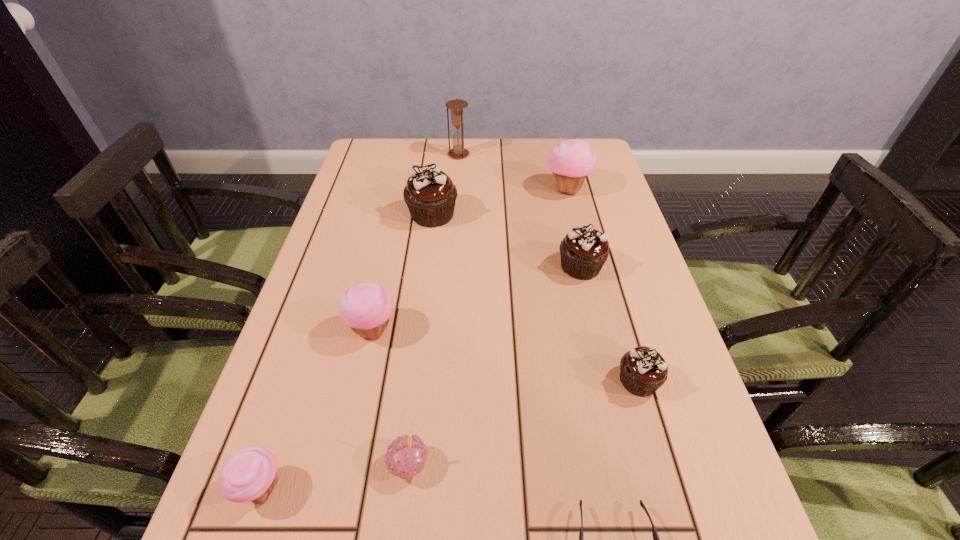
Locate an element on the screen. hourglass is located at coordinates (x=457, y=119).

At what (x,y) coordinates should I click in order to perform the action: click on brown hourglass. Please return your answer as a coordinate pair (x, y). This screenshot has height=540, width=960. Looking at the image, I should click on (457, 119).

In order to click on the farthest brown cupcake in this screenshot , I will do `click(430, 194)`.

Identify the location of the leftmost brown cupcake. The width and height of the screenshot is (960, 540). (430, 194).

Where is `the farthest pink cupcake`? the farthest pink cupcake is located at coordinates (570, 161).

Find the location of a particular element. The width and height of the screenshot is (960, 540). the biggest pink cupcake is located at coordinates (570, 161).

Find the location of a particular element. This screenshot has width=960, height=540. the second farthest brown cupcake is located at coordinates (584, 250).

Where is `the sixth nearest object`? This screenshot has height=540, width=960. the sixth nearest object is located at coordinates (584, 250).

At what (x,y) coordinates should I click in order to perform the action: click on the second farthest pink cupcake. Please return your answer as a coordinate pair (x, y). The width and height of the screenshot is (960, 540). Looking at the image, I should click on (366, 307).

You are a GUI agent. You are given a task and a screenshot of the screen. Output one action in this format:
    pyautogui.click(x=<x>, y=<y>)
    Task: Click on the fourth nearest cupcake
    
    Given the screenshot: What is the action you would take?
    pyautogui.click(x=366, y=307)